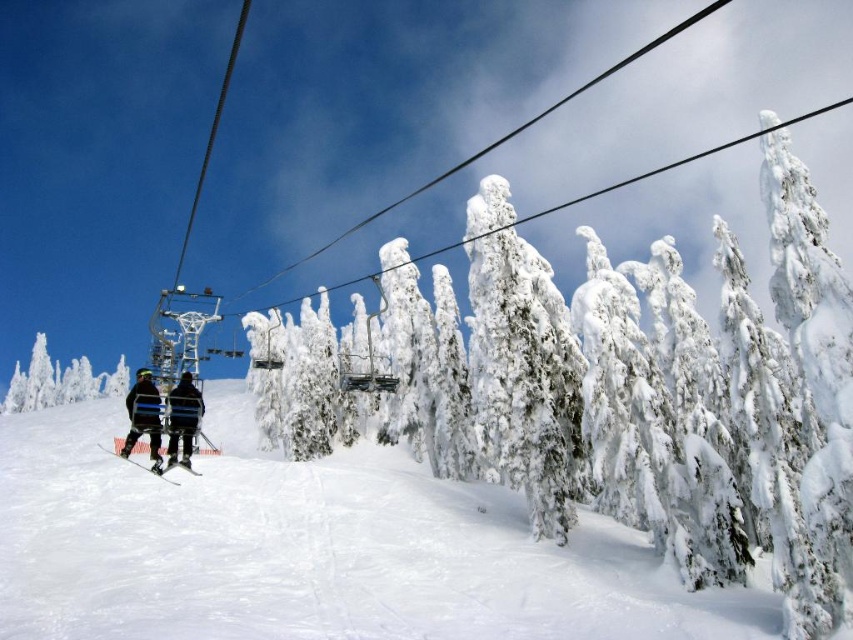
You are a photographer planning to capture a wide shot of the white snow ski slope at lower left and the black matte ski suit at center. Which object should you focus on first if you want to include both in your frame without zooming in or out?

You should focus on the white snow ski slope at lower left first because it has a larger size compared to the black matte ski suit at center, allowing it to fit into the frame more easily while still capturing the smaller object.

You are standing at point (135, 426) and want to walk to point (96, 513). Based on the scene description, will you have to go around any obstacles or can you walk straight?

Point (96, 513) is behind point (135, 426), so you will have to go around obstacles to reach it.

You are standing at the point with coordinates (143, 417) in the ski resort scene. What object is located exactly at this point?

The black matte ski suit at center is located exactly at point (143, 417).